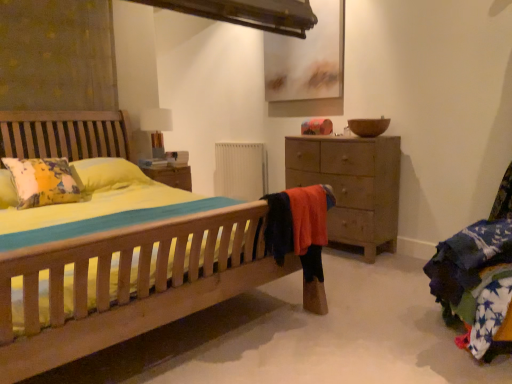
Question: Does white fabric table lamp at upper center have a larger size compared to white matte radiator at center?

Choices:
 (A) yes
 (B) no

Answer: (B)

Question: Is white fabric table lamp at upper center with white matte radiator at center?

Choices:
 (A) no
 (B) yes

Answer: (A)

Question: Is white fabric table lamp at upper center thinner than white matte radiator at center?

Choices:
 (A) no
 (B) yes

Answer: (A)

Question: From the image's perspective, does white fabric table lamp at upper center appear higher than white matte radiator at center?

Choices:
 (A) yes
 (B) no

Answer: (A)

Question: Considering the relative sizes of white fabric table lamp at upper center and white matte radiator at center in the image provided, is white fabric table lamp at upper center wider than white matte radiator at center?

Choices:
 (A) no
 (B) yes

Answer: (B)

Question: From the image's perspective, is white fabric table lamp at upper center positioned above or below white matte radiator at center?

Choices:
 (A) above
 (B) below

Answer: (A)

Question: Would you say white fabric table lamp at upper center is to the left or to the right of white matte radiator at center in the picture?

Choices:
 (A) left
 (B) right

Answer: (A)

Question: Is white fabric table lamp at upper center in front of or behind white matte radiator at center in the image?

Choices:
 (A) front
 (B) behind

Answer: (A)

Question: Is white fabric table lamp at upper center taller or shorter than white matte radiator at center?

Choices:
 (A) tall
 (B) short

Answer: (B)

Question: Is point click(x=254, y=162) closer or farther from the camera than point click(x=155, y=109)?

Choices:
 (A) farther
 (B) closer

Answer: (A)

Question: Is white matte radiator at center situated inside white fabric table lamp at upper center or outside?

Choices:
 (A) outside
 (B) inside

Answer: (A)

Question: Is white matte radiator at center bigger or smaller than white fabric table lamp at upper center?

Choices:
 (A) small
 (B) big

Answer: (B)

Question: From the image's perspective, is white matte radiator at center positioned above or below white fabric table lamp at upper center?

Choices:
 (A) above
 (B) below

Answer: (B)

Question: From a real-world perspective, is white fabric table lamp at upper center physically located above or below wooden chest of drawers at right?

Choices:
 (A) below
 (B) above

Answer: (B)

Question: Looking at their shapes, would you say white fabric table lamp at upper center is wider or thinner than wooden chest of drawers at right?

Choices:
 (A) thin
 (B) wide

Answer: (A)